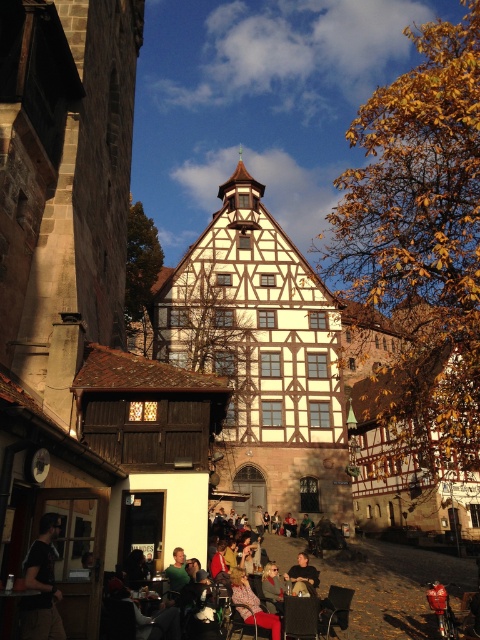
Does point (36, 625) come farther from viewer compared to point (292, 548)?

That is False.

Does dark gray fabric jacket at lower left have a greater height compared to matte black jacket at center?

No, dark gray fabric jacket at lower left is not taller than matte black jacket at center.

Where is `dark gray fabric jacket at lower left`? dark gray fabric jacket at lower left is located at coordinates (41, 584).

Identify the location of dark gray fabric jacket at lower left. (41, 584).